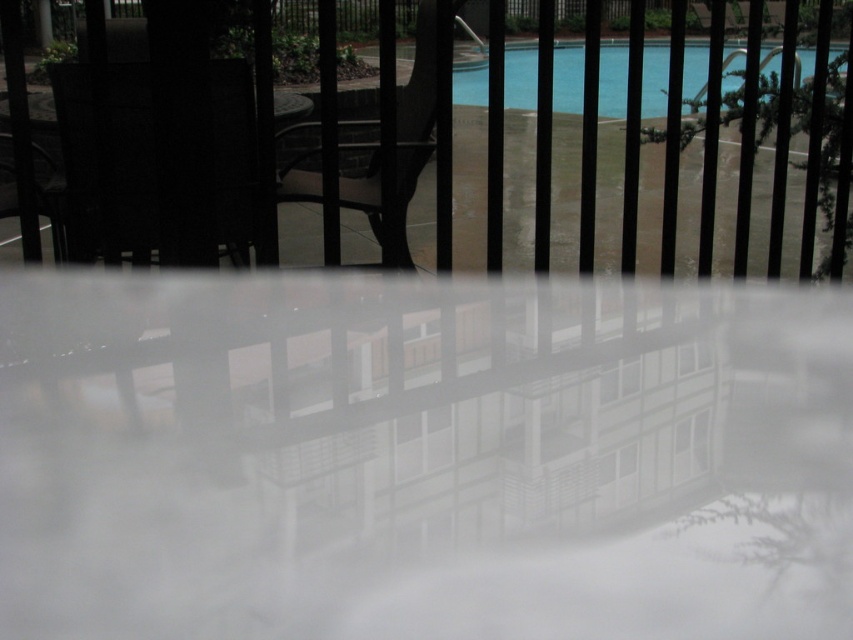
You are designing a seating arrangement for a small gathering. You have two matte black chairs available. The first is the matte black chair at left, and the second is the matte black chair at center. Which chair should you choose if you want the wider one for more seating space?

The matte black chair at center has a greater width than the matte black chair at left, so you should choose the matte black chair at center for more seating space.

You are a delivery robot with a package that is 15 inches wide. You need to move through the space between the two matte black chairs. Can you fit through the gap between the matte black chair at left and the matte black chair at center?

The matte black chair at left and the matte black chair at center are 14.93 inches apart, which is slightly less than the 15 inch width of the package. The robot cannot fit through the gap between the matte black chair at left and the matte black chair at center.

You are sitting at a table inside a building and looking out through a window. You see a matte black chair at center and a blue glossy water at upper center outside. Which object is positioned to the left when viewed from your perspective?

The matte black chair at center is to the left of the blue glossy water at upper center from your perspective.